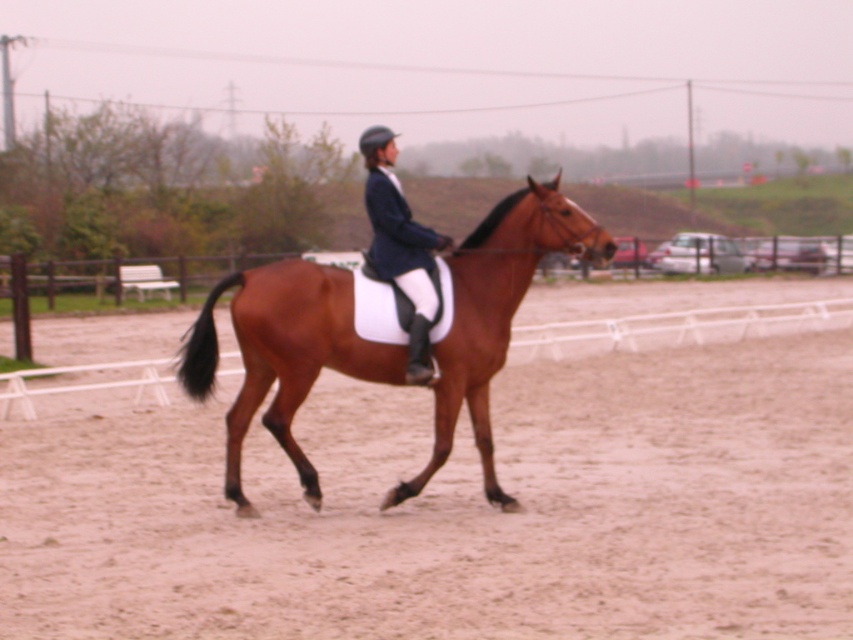
Does brown glossy horse at center have a lesser width compared to matte black jacket at center?

No.

Consider the image. Is brown glossy horse at center to the right of matte black jacket at center from the viewer's perspective?

Yes, brown glossy horse at center is to the right of matte black jacket at center.

Does point (224, 481) lie behind point (410, 224)?

Yes, point (224, 481) is farther from viewer.

Locate an element on the screen. This screenshot has height=640, width=853. brown glossy horse at center is located at coordinates (282, 355).